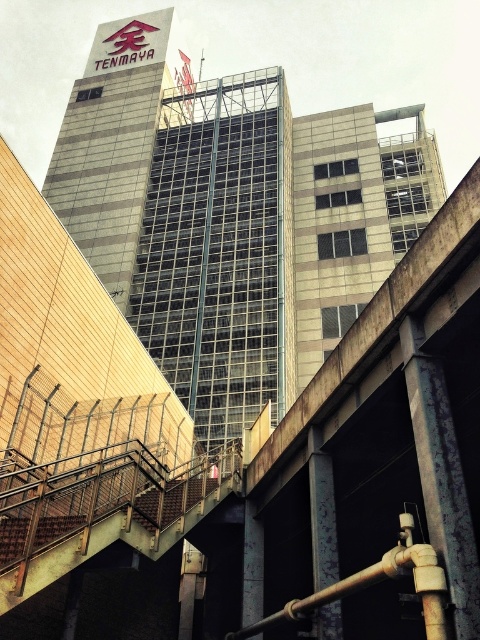
From the picture: Which is above, concrete bridge at center or gray glass building at upper center?

Positioned higher is gray glass building at upper center.

Can you confirm if concrete bridge at center is shorter than gray glass building at upper center?

Correct, concrete bridge at center is not as tall as gray glass building at upper center.

Between point (351, 468) and point (100, 180), which one is positioned in front?

Point (351, 468) is more forward.

Locate an element on the screen. The image size is (480, 640). concrete bridge at center is located at coordinates (381, 461).

Which of these two, concrete bridge at center or brown wooden stairs at lower center, stands shorter?

With less height is brown wooden stairs at lower center.

Is point (330, 420) closer to viewer compared to point (152, 513)?

That is True.

This screenshot has height=640, width=480. Describe the element at coordinates (381, 461) in the screenshot. I see `concrete bridge at center` at that location.

This screenshot has height=640, width=480. I want to click on concrete bridge at center, so click(x=381, y=461).

Which is behind, point (87, 202) or point (179, 477)?

Point (87, 202)

Who is taller, gray glass building at upper center or brown wooden stairs at lower center?

With more height is gray glass building at upper center.

Describe the element at coordinates (113, 141) in the screenshot. I see `gray glass building at upper center` at that location.

The image size is (480, 640). Find the location of `gray glass building at upper center`. gray glass building at upper center is located at coordinates (113, 141).